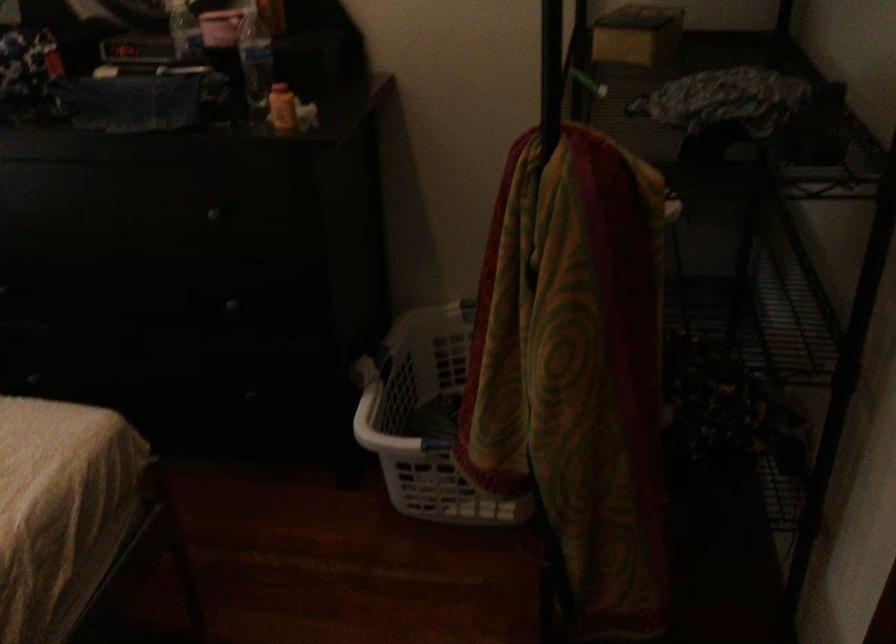
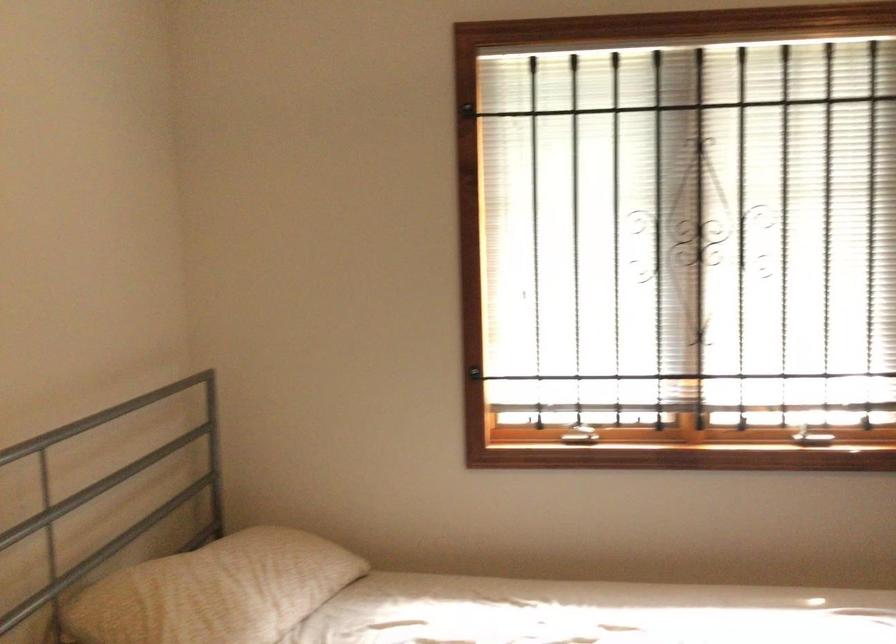
Question: How did the camera likely rotate?

Choices:
 (A) Left
 (B) Right
 (C) Up
 (D) Down

Answer: (A)